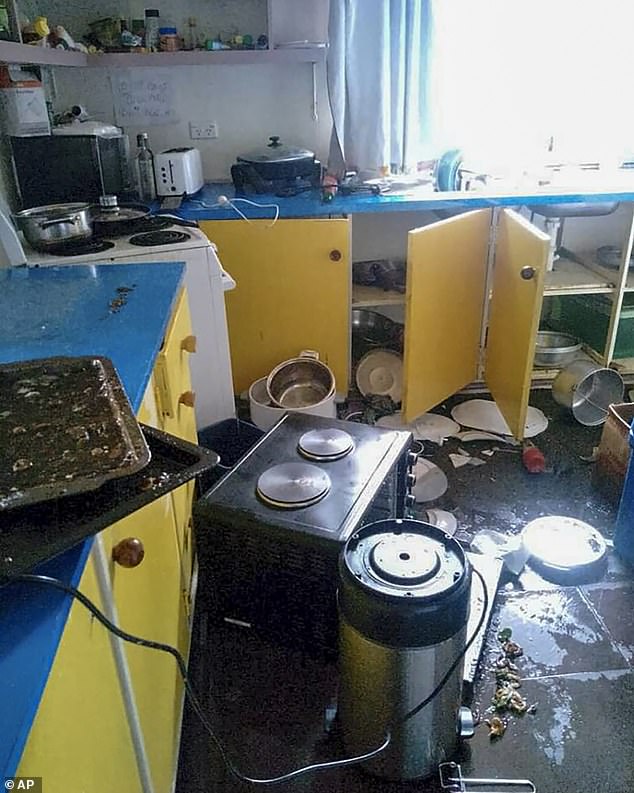
The height and width of the screenshot is (793, 634). Find the location of `cabinet doors`. cabinet doors is located at coordinates (476, 270), (82, 700), (149, 588), (179, 414), (287, 293), (518, 319).